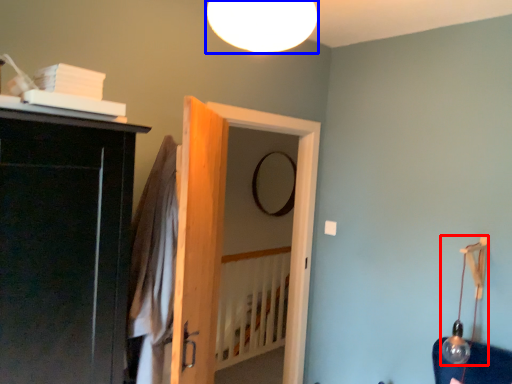
Question: Among these objects, which one is farthest to the camera, lamp (highlighted by a red box) or lamp (highlighted by a blue box)?

Choices:
 (A) lamp
 (B) lamp

Answer: (A)